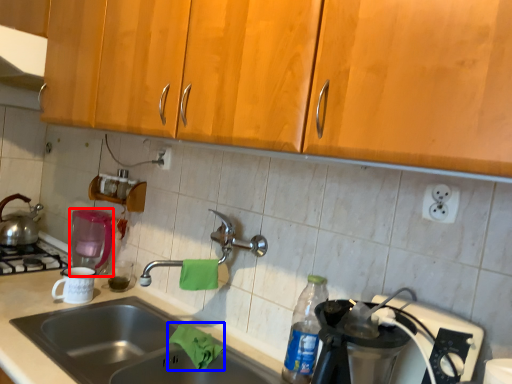
Question: Which object appears closest to the camera in this image, coffee machine (highlighted by a red box) or material (highlighted by a blue box)?

Choices:
 (A) coffee machine
 (B) material

Answer: (B)